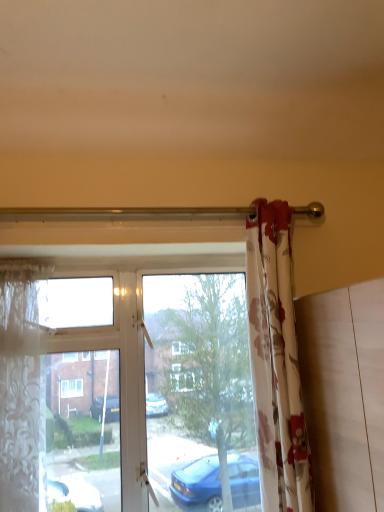
Question: Is translucent floral fabric at left, the first curtain when ordered from left to right, to the left or to the right of floral fabric curtain at right, the 2th curtain from the left, in the image?

Choices:
 (A) right
 (B) left

Answer: (B)

Question: Is point (41, 434) positioned closer to the camera than point (254, 402)?

Choices:
 (A) farther
 (B) closer

Answer: (A)

Question: Estimate the real-world distances between objects in this image. Which object is farther from the translucent floral fabric at left, the first curtain when ordered from left to right?

Choices:
 (A) transparent glass window at center
 (B) floral fabric curtain at right, placed as the first curtain when sorted from right to left

Answer: (B)

Question: Based on their relative distances, which object is farther from the transparent glass window at center?

Choices:
 (A) translucent floral fabric at left, the first curtain when ordered from left to right
 (B) floral fabric curtain at right, the 2th curtain from the left

Answer: (A)